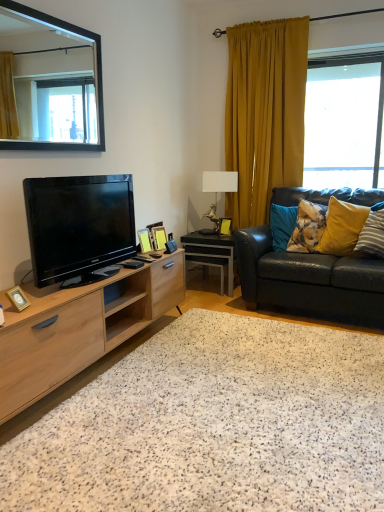
Question: Is black framed mirror at upper left oriented towards metallic gold lamp at center?

Choices:
 (A) yes
 (B) no

Answer: (B)

Question: Is there a large distance between black framed mirror at upper left and metallic gold lamp at center?

Choices:
 (A) yes
 (B) no

Answer: (A)

Question: Does black framed mirror at upper left have a greater height compared to metallic gold lamp at center?

Choices:
 (A) yes
 (B) no

Answer: (A)

Question: From a real-world perspective, is black framed mirror at upper left physically below metallic gold lamp at center?

Choices:
 (A) no
 (B) yes

Answer: (A)

Question: Is black framed mirror at upper left at the right side of metallic gold lamp at center?

Choices:
 (A) yes
 (B) no

Answer: (B)

Question: Is black framed mirror at upper left not within metallic gold lamp at center?

Choices:
 (A) yes
 (B) no

Answer: (A)

Question: Does black glossy side table at center have a greater width compared to white speckled carpet at center?

Choices:
 (A) yes
 (B) no

Answer: (B)

Question: Does black glossy side table at center have a greater height compared to white speckled carpet at center?

Choices:
 (A) no
 (B) yes

Answer: (B)

Question: Can we say black glossy side table at center lies outside white speckled carpet at center?

Choices:
 (A) no
 (B) yes

Answer: (B)

Question: From the image's perspective, is black glossy side table at center beneath white speckled carpet at center?

Choices:
 (A) no
 (B) yes

Answer: (A)

Question: From a real-world perspective, is black glossy side table at center below white speckled carpet at center?

Choices:
 (A) no
 (B) yes

Answer: (A)

Question: Is black glossy side table at center turned away from white speckled carpet at center?

Choices:
 (A) yes
 (B) no

Answer: (B)

Question: Considering the relative sizes of natural wood cabinet at left and gold metallic photo frame at lower left, acting as the 1th picture frame starting from the front, in the image provided, is natural wood cabinet at left smaller than gold metallic photo frame at lower left, acting as the 1th picture frame starting from the front,?

Choices:
 (A) no
 (B) yes

Answer: (A)